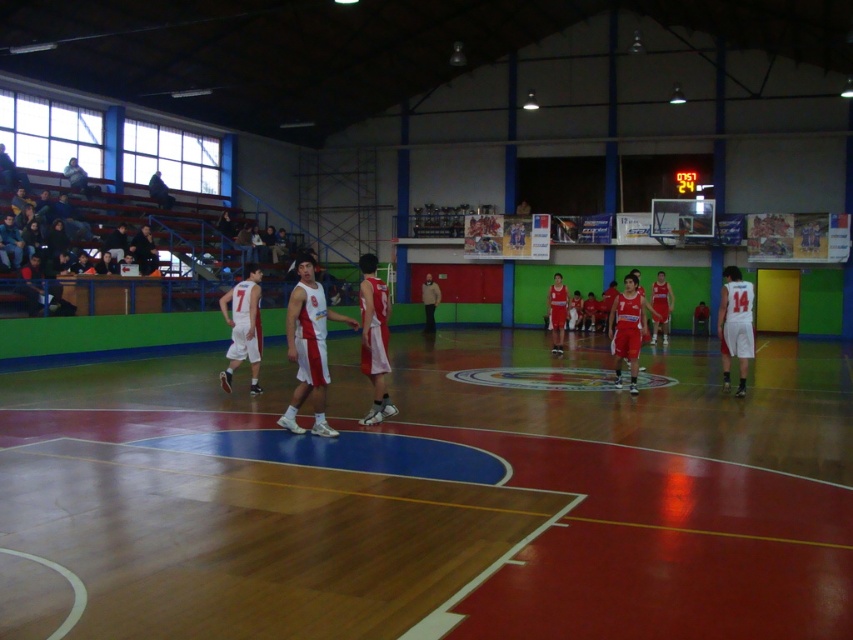
Question: Which is nearer to the white matte basketball player at right?

Choices:
 (A) matte black jacket at upper left
 (B) white matte basketball player at center
 (C) wooden floor at center
 (D) red jersey basketball player at center

Answer: (C)

Question: Can you confirm if white matte basketball player at right is positioned to the right of light brown leather jacket at center?

Choices:
 (A) yes
 (B) no

Answer: (A)

Question: Considering the real-world distances, which object is closest to the wooden floor at center?

Choices:
 (A) white matte basketball player at center
 (B) light brown leather jacket at center
 (C) white matte basketball player at right
 (D) matte black jacket at upper left

Answer: (A)

Question: Can you confirm if wooden floor at center is wider than light brown leather jacket at center?

Choices:
 (A) yes
 (B) no

Answer: (A)

Question: Which of the following is the closest to the observer?

Choices:
 (A) (85, 173)
 (B) (291, 410)
 (C) (225, 308)

Answer: (B)

Question: Does red jersey basketball player at center have a larger size compared to light brown leather jacket at center?

Choices:
 (A) yes
 (B) no

Answer: (A)